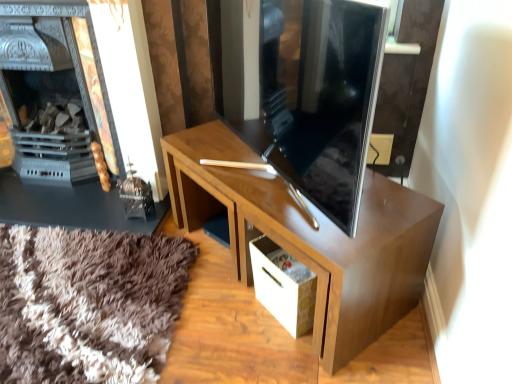
Describe the element at coordinates (52, 92) in the screenshot. I see `matte black fireplace at left` at that location.

The height and width of the screenshot is (384, 512). Identify the location of white cardboard drawer at lower center. (283, 285).

Considering the relative sizes of glossy wood desk at center and white cardboard drawer at lower center in the image provided, is glossy wood desk at center thinner than white cardboard drawer at lower center?

No.

Would you say glossy wood desk at center is a long distance from white cardboard drawer at lower center?

No, glossy wood desk at center is in close proximity to white cardboard drawer at lower center.

Considering the relative positions of glossy wood desk at center and white cardboard drawer at lower center in the image provided, is glossy wood desk at center to the left of white cardboard drawer at lower center from the viewer's perspective?

Correct, you'll find glossy wood desk at center to the left of white cardboard drawer at lower center.

From the picture: Who is smaller, glossy wood desk at center or white cardboard drawer at lower center?

white cardboard drawer at lower center.

Are glossy wood desk at center and matte black fireplace at left located far from each other?

Actually, glossy wood desk at center and matte black fireplace at left are a little close together.

Does point (372, 282) come in front of point (46, 108)?

Yes, point (372, 282) is in front of point (46, 108).

Considering the positions of objects glossy wood desk at center and matte black fireplace at left in the image provided, who is more to the left, glossy wood desk at center or matte black fireplace at left?

matte black fireplace at left.

Can you confirm if glossy wood desk at center is smaller than matte black fireplace at left?

Yes, glossy wood desk at center is smaller than matte black fireplace at left.

From the image's perspective, which is below, matte black fireplace at left or glossy wood desk at center?

From the image's view, glossy wood desk at center is below.

In order to click on fireplace that appears above the glossy wood desk at center (from a real-world perspective) in this screenshot , I will do `click(52, 92)`.

Based on the photo, considering the positions of objects matte black fireplace at left and glossy wood desk at center in the image provided, who is in front, matte black fireplace at left or glossy wood desk at center?

glossy wood desk at center is more forward.

Measure the distance between matte black fireplace at left and white cardboard drawer at lower center.

matte black fireplace at left is 4.11 feet from white cardboard drawer at lower center.

Is matte black fireplace at left inside the boundaries of white cardboard drawer at lower center, or outside?

matte black fireplace at left is located beyond the bounds of white cardboard drawer at lower center.

Where is `drawer in front of the matte black fireplace at left`? drawer in front of the matte black fireplace at left is located at coordinates (283, 285).

Is white cardboard drawer at lower center at the back of matte black fireplace at left?

No.

Is white cardboard drawer at lower center situated inside matte black fireplace at left or outside?

white cardboard drawer at lower center is located beyond the bounds of matte black fireplace at left.

Which is more to the left, white cardboard drawer at lower center or matte black fireplace at left?

matte black fireplace at left is more to the left.

Is the surface of white cardboard drawer at lower center in direct contact with matte black fireplace at left?

white cardboard drawer at lower center and matte black fireplace at left are not in contact.

Considering the sizes of white cardboard drawer at lower center and glossy wood desk at center in the image, is white cardboard drawer at lower center taller or shorter than glossy wood desk at center?

In the image, white cardboard drawer at lower center appears to be shorter than glossy wood desk at center.

Which is in front, point (253, 253) or point (244, 217)?

The point (244, 217) is closer.

Where is `desk in front of the white cardboard drawer at lower center`? This screenshot has height=384, width=512. desk in front of the white cardboard drawer at lower center is located at coordinates (311, 237).

Which object is more forward, white cardboard drawer at lower center or glossy wood desk at center?

Positioned in front is glossy wood desk at center.

Locate an element on the screen. desk above the white cardboard drawer at lower center (from a real-world perspective) is located at coordinates (311, 237).

Locate an element on the screen. The width and height of the screenshot is (512, 384). desk that is under the matte black fireplace at left (from a real-world perspective) is located at coordinates tap(311, 237).

Which object lies further to the anchor point matte black fireplace at left, glossy wood desk at center or white cardboard drawer at lower center?

The object further to matte black fireplace at left is white cardboard drawer at lower center.

Based on their spatial positions, is white cardboard drawer at lower center or matte black fireplace at left further from glossy wood desk at center?

Based on the image, matte black fireplace at left appears to be further to glossy wood desk at center.

Looking at the image, which one is located further to glossy wood desk at center, matte black fireplace at left or white cardboard drawer at lower center?

→ The object further to glossy wood desk at center is matte black fireplace at left.

Based on their spatial positions, is glossy wood desk at center or matte black fireplace at left closer to white cardboard drawer at lower center?

Among the two, glossy wood desk at center is located nearer to white cardboard drawer at lower center.

Which object lies nearer to the anchor point white cardboard drawer at lower center, matte black fireplace at left or glossy wood desk at center?

Among the two, glossy wood desk at center is located nearer to white cardboard drawer at lower center.

When comparing their distances from matte black fireplace at left, does white cardboard drawer at lower center or glossy wood desk at center seem further?

white cardboard drawer at lower center lies further to matte black fireplace at left than the other object.

Image resolution: width=512 pixels, height=384 pixels. In order to click on desk situated between matte black fireplace at left and white cardboard drawer at lower center from left to right in this screenshot , I will do `click(311, 237)`.